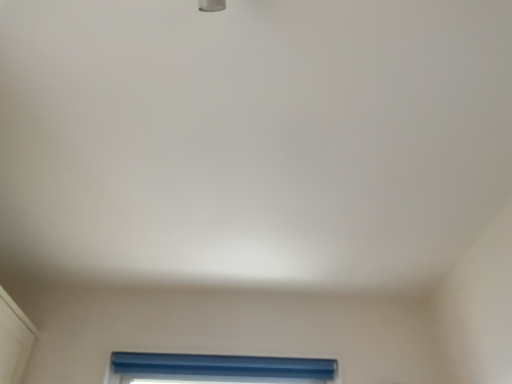
Question: Should I look upward or downward to see blue matte window at lower center?

Choices:
 (A) up
 (B) down

Answer: (B)